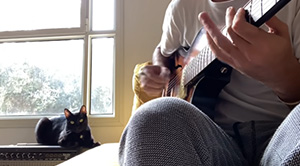
Identify the location of window. Image resolution: width=300 pixels, height=166 pixels. (60, 61).